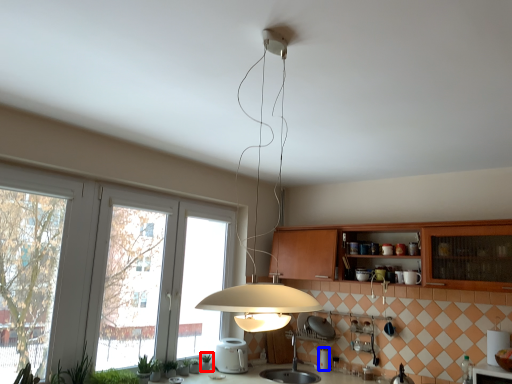
Question: Among these objects, which one is nearest to the camera, plant (highlighted by a red box) or appliance (highlighted by a blue box)?

Choices:
 (A) plant
 (B) appliance

Answer: (A)